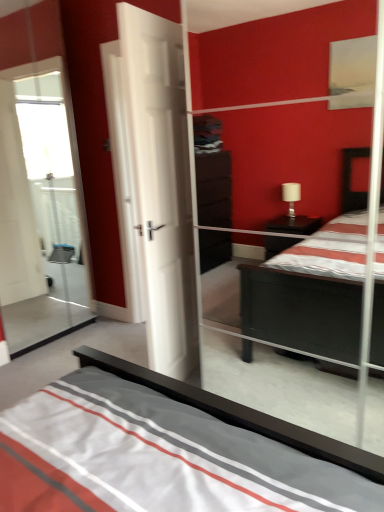
The image size is (384, 512). Find the location of `transparent glass door at left`. transparent glass door at left is located at coordinates (40, 210).

The image size is (384, 512). What do you see at coordinates (40, 210) in the screenshot?
I see `transparent glass door at left` at bounding box center [40, 210].

Measure the distance between point (148, 111) and camera.

A distance of 6.50 feet exists between point (148, 111) and camera.

Identify the location of white matte door at center. (159, 183).

The height and width of the screenshot is (512, 384). What do you see at coordinates (159, 183) in the screenshot?
I see `white matte door at center` at bounding box center [159, 183].

This screenshot has height=512, width=384. I want to click on transparent glass door at left, so click(40, 210).

Which is more to the left, white matte door at center or transparent glass door at left?

transparent glass door at left.

Which object is further away from the camera, white matte door at center or transparent glass door at left?

Positioned behind is transparent glass door at left.

Is point (126, 99) behind point (36, 244)?

No, it is in front of (36, 244).

From the image's perspective, which object appears higher, white matte door at center or transparent glass door at left?

transparent glass door at left is shown above in the image.

From a real-world perspective, is white matte door at center above or below transparent glass door at left?

In terms of real-world spatial position, white matte door at center is below transparent glass door at left.

Between white matte door at center and transparent glass door at left, which one has larger width?

white matte door at center is wider.

Who is shorter, white matte door at center or transparent glass door at left?

With less height is white matte door at center.

Who is bigger, white matte door at center or transparent glass door at left?

Bigger between the two is white matte door at center.

Does white matte door at center contain transparent glass door at left?

No, transparent glass door at left is not surrounded by white matte door at center.

In the scene shown: Is white matte door at center with transparent glass door at left?

No, white matte door at center is not touching transparent glass door at left.

Is transparent glass door at left at the back of white matte door at center?

white matte door at center is not turned away from transparent glass door at left.

Measure the distance from white matte door at center to transparent glass door at left.

A distance of 5.13 feet exists between white matte door at center and transparent glass door at left.

Where is `glass door that is behind the white matte door at center`? The height and width of the screenshot is (512, 384). glass door that is behind the white matte door at center is located at coordinates (40, 210).

Between transparent glass door at left and white matte door at center, which one appears on the left side from the viewer's perspective?

From the viewer's perspective, transparent glass door at left appears more on the left side.

In the image, is transparent glass door at left positioned in front of or behind white matte door at center?

transparent glass door at left is behind white matte door at center.

Is point (54, 113) positioned after point (124, 65)?

Yes, it is.

From the image's perspective, is transparent glass door at left positioned above or below white matte door at center?

transparent glass door at left is situated higher than white matte door at center in the image.

From a real-world perspective, is transparent glass door at left positioned above or below white matte door at center?

In terms of real-world spatial position, transparent glass door at left is above white matte door at center.

Is transparent glass door at left thinner than white matte door at center?

Yes.

Considering the sizes of transparent glass door at left and white matte door at center in the image, is transparent glass door at left taller or shorter than white matte door at center?

transparent glass door at left is taller than white matte door at center.

In the scene shown: In terms of size, does transparent glass door at left appear bigger or smaller than white matte door at center?

In the image, transparent glass door at left appears to be smaller than white matte door at center.

Would you say transparent glass door at left is inside or outside white matte door at center?

transparent glass door at left lies outside white matte door at center.

Consider the image. Is transparent glass door at left positioned far away from white matte door at center?

transparent glass door at left is far away from white matte door at center.

Is transparent glass door at left facing away from white matte door at center?

Yes, white matte door at center is at the back of transparent glass door at left.

How many degrees apart are the facing directions of transparent glass door at left and white matte door at center?

They differ by 171 degrees in their facing directions.

How far apart are transparent glass door at left and white matte door at center?

transparent glass door at left and white matte door at center are 1.56 meters apart.

Find the location of a particular element. The image size is (384, 512). door that is below the transparent glass door at left (from the image's perspective) is located at coordinates (x=159, y=183).

Where is `glass door above the white matte door at center (from the image's perspective)`? The height and width of the screenshot is (512, 384). glass door above the white matte door at center (from the image's perspective) is located at coordinates (40, 210).

You are a GUI agent. You are given a task and a screenshot of the screen. Output one action in this format:
    pyautogui.click(x=<x>, y=<y>)
    Task: Click on the glass door on the left of white matte door at center
    The height and width of the screenshot is (512, 384).
    Given the screenshot: What is the action you would take?
    pyautogui.click(x=40, y=210)